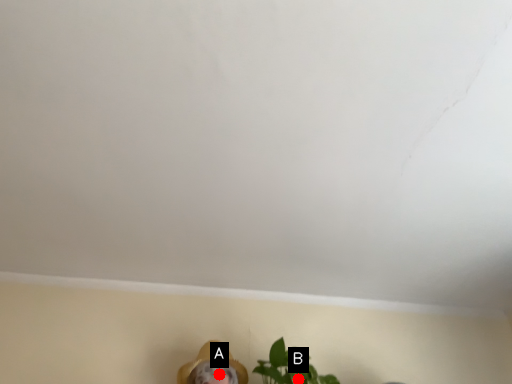
Question: Two points are circled on the image, labeled by A and B beside each circle. Which point is farther to the camera?

Choices:
 (A) A is further
 (B) B is further

Answer: (A)